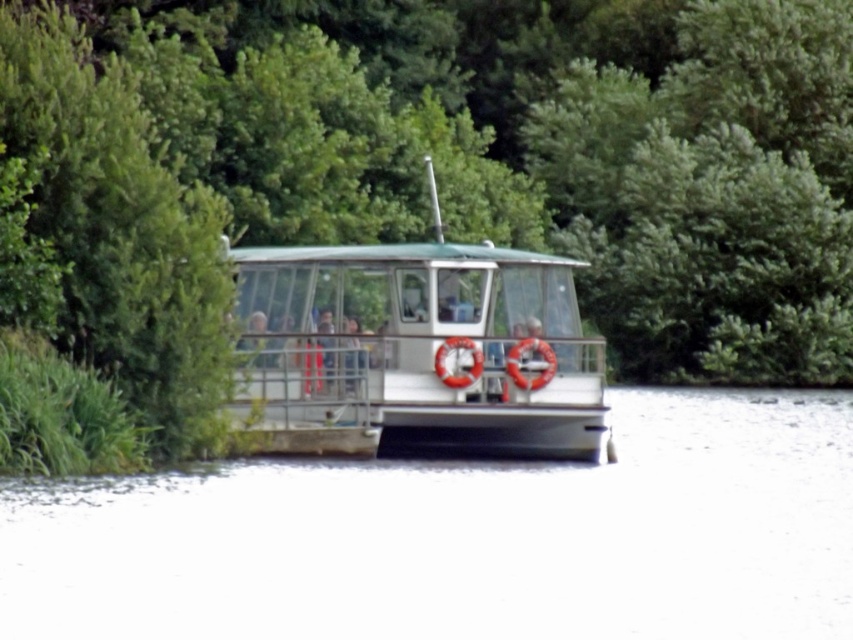
Question: Which of the following is the closest to the observer?

Choices:
 (A) (778, 515)
 (B) (300, 148)

Answer: (A)

Question: Does green leafy tree at center have a larger size compared to white smooth water at center?

Choices:
 (A) no
 (B) yes

Answer: (B)

Question: Can you confirm if green leafy tree at center is positioned to the right of white smooth water at center?

Choices:
 (A) yes
 (B) no

Answer: (B)

Question: Which object appears farthest from the camera in this image?

Choices:
 (A) green leafy tree at center
 (B) white smooth water at center
 (C) white glossy boat at center

Answer: (C)

Question: Among these points, which one is nearest to the camera?

Choices:
 (A) (252, 339)
 (B) (361, 32)
 (C) (404, 611)

Answer: (C)

Question: From the image, what is the correct spatial relationship of green leafy tree at center in relation to white smooth water at center?

Choices:
 (A) left
 (B) right

Answer: (A)